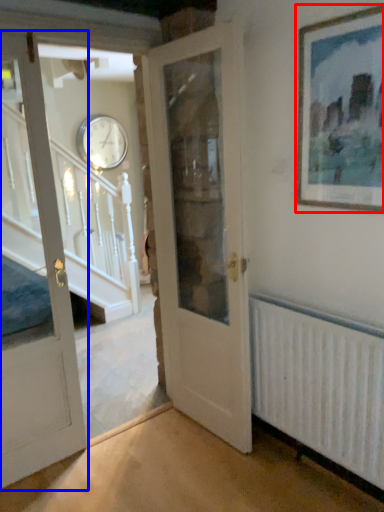
Question: Which of the following is the closest to the observer, picture frame (highlighted by a red box) or door (highlighted by a blue box)?

Choices:
 (A) picture frame
 (B) door

Answer: (A)